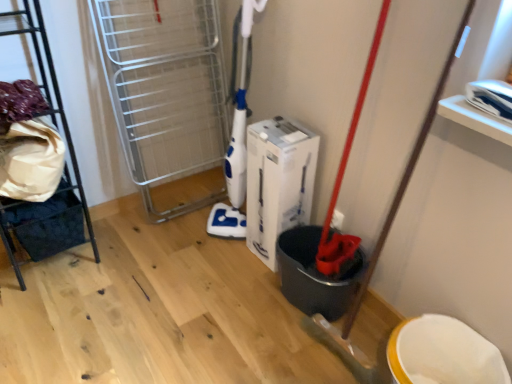
Where is `free space that is in between metallic black rack at left and white cardboard box at center`? The image size is (512, 384). free space that is in between metallic black rack at left and white cardboard box at center is located at coordinates (157, 257).